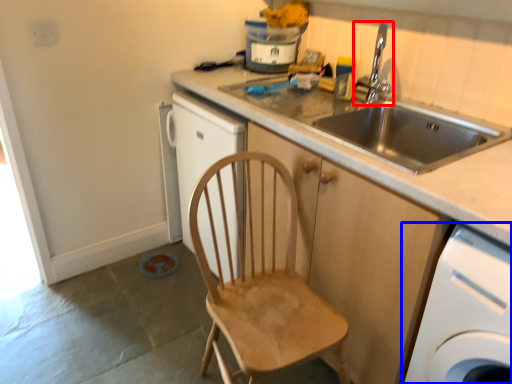
Question: Which of the following is the farthest to the observer, tap (highlighted by a red box) or home appliance (highlighted by a blue box)?

Choices:
 (A) tap
 (B) home appliance

Answer: (A)